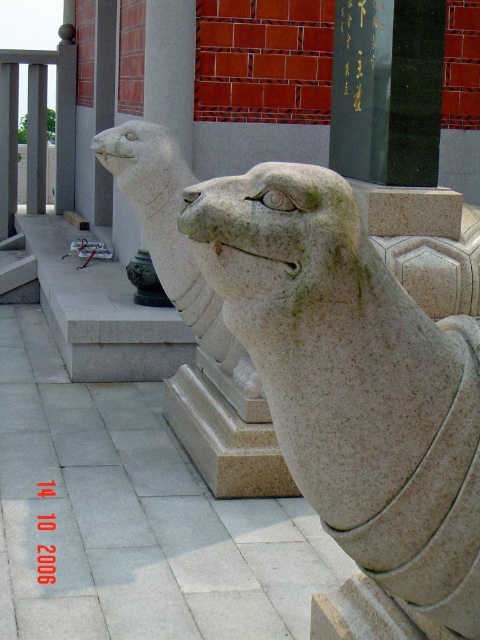
Question: Which of the following is the farthest from the observer?

Choices:
 (A) gray stone lion at center
 (B) granite statue at center

Answer: (A)

Question: Which point is closer to the camera?

Choices:
 (A) (131, 136)
 (B) (444, 385)

Answer: (B)

Question: Observing the image, what is the correct spatial positioning of granite statue at center in reference to gray stone lion at center?

Choices:
 (A) above
 (B) below

Answer: (B)

Question: From the image, what is the correct spatial relationship of granite statue at center in relation to gray stone lion at center?

Choices:
 (A) above
 (B) below

Answer: (B)

Question: Does granite statue at center have a larger size compared to gray stone lion at center?

Choices:
 (A) yes
 (B) no

Answer: (B)